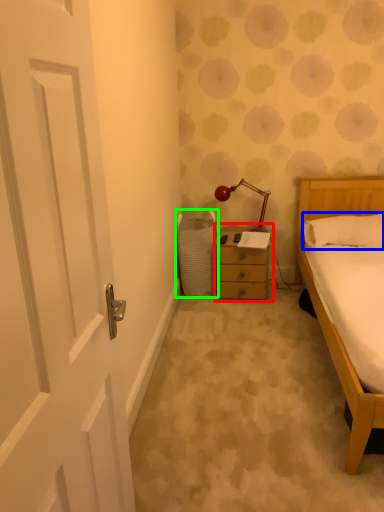
Question: Which object is positioned farthest from nightstand (highlighted by a red box)? Select from pillow (highlighted by a blue box) and laundry basket (highlighted by a green box).

Choices:
 (A) pillow
 (B) laundry basket

Answer: (A)